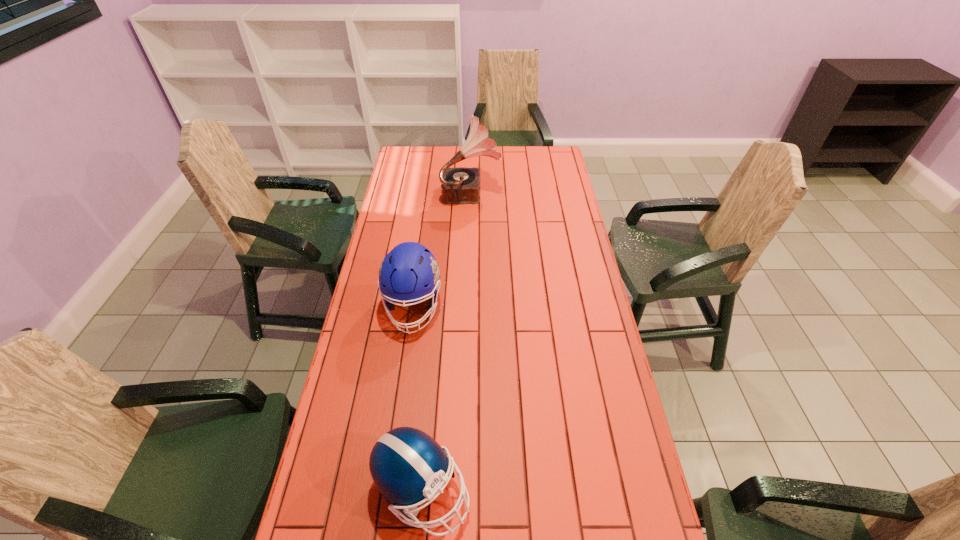
You are a GUI agent. You are given a task and a screenshot of the screen. Output one action in this format:
    pyautogui.click(x=<x>, y=<y>)
    Task: Click on the tallest object
    The image size is (960, 540).
    Given the screenshot: What is the action you would take?
    pyautogui.click(x=460, y=185)

The image size is (960, 540). I want to click on the farthest object, so click(x=460, y=185).

Find the location of `the second nearest object`. the second nearest object is located at coordinates (409, 272).

Locate an element on the screen. The height and width of the screenshot is (540, 960). the farther football helmet is located at coordinates (409, 272).

Find the location of a particular element. free location located 0.160m from the horn of the farthest object is located at coordinates click(x=536, y=192).

What are the coordinates of `vacant space positioned 0.360m on the face guard of the second nearest object` in the screenshot? It's located at (393, 451).

At what (x,y) coordinates should I click in order to perform the action: click on object that is at the left edge. Please return your answer as a coordinate pair (x, y). Looking at the image, I should click on (409, 272).

Identify the location of vacant space at the far edge. Image resolution: width=960 pixels, height=540 pixels. (487, 168).

Find the location of a particular element. The width and height of the screenshot is (960, 540). vacant space at the left edge of the desktop is located at coordinates (348, 428).

Identify the location of free region at the right edge. Image resolution: width=960 pixels, height=540 pixels. (619, 433).